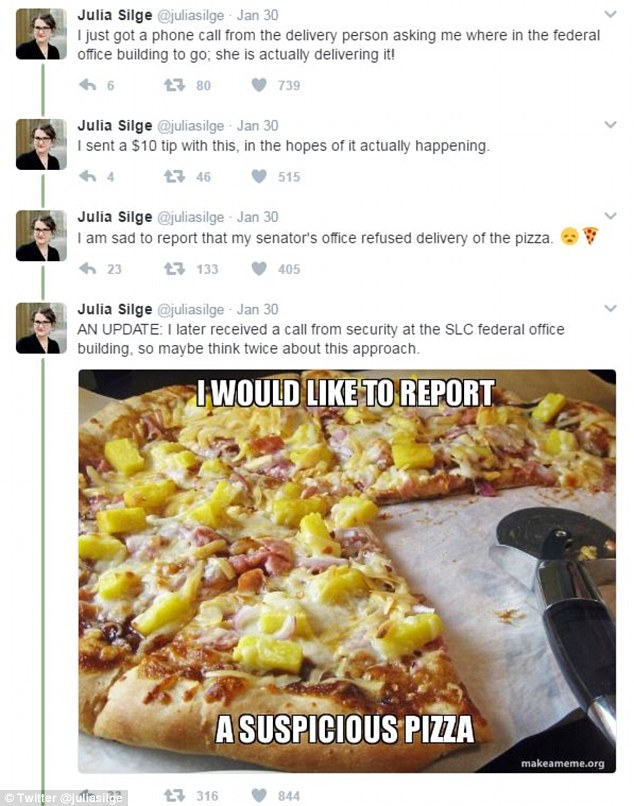
Where is `handle`? The height and width of the screenshot is (806, 634). handle is located at coordinates (581, 603).